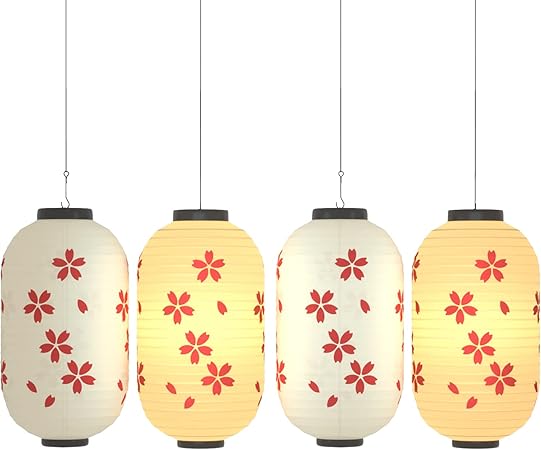
This screenshot has width=541, height=450. Find the location of `white lantern`. white lantern is located at coordinates (78, 375), (359, 417).